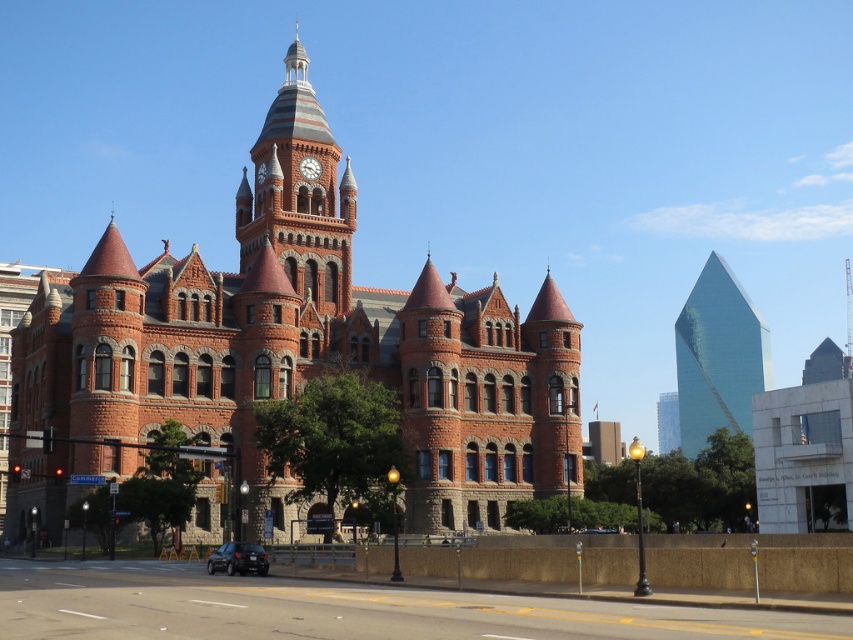
Between red brick church at center and red brick clock tower at center, which one has less height?

Standing shorter between the two is red brick clock tower at center.

Is point (241, 403) closer to viewer compared to point (337, 276)?

Yes, it is in front of point (337, 276).

Locate an element on the screen. Image resolution: width=853 pixels, height=640 pixels. red brick church at center is located at coordinates point(286,355).

Can you confirm if red brick clock tower at center is bigger than matte red clock at center?

Correct, red brick clock tower at center is larger in size than matte red clock at center.

Between red brick clock tower at center and matte red clock at center, which one appears on the right side from the viewer's perspective?

From the viewer's perspective, matte red clock at center appears more on the right side.

Find the location of a particular element. red brick clock tower at center is located at coordinates tap(297, 196).

Which is more to the left, red brick clock tower at center or glassy reflective skyscraper at right?

Positioned to the left is red brick clock tower at center.

Which is below, red brick clock tower at center or glassy reflective skyscraper at right?

→ glassy reflective skyscraper at right is below.

What do you see at coordinates (297, 196) in the screenshot? I see `red brick clock tower at center` at bounding box center [297, 196].

Image resolution: width=853 pixels, height=640 pixels. I want to click on red brick clock tower at center, so click(297, 196).